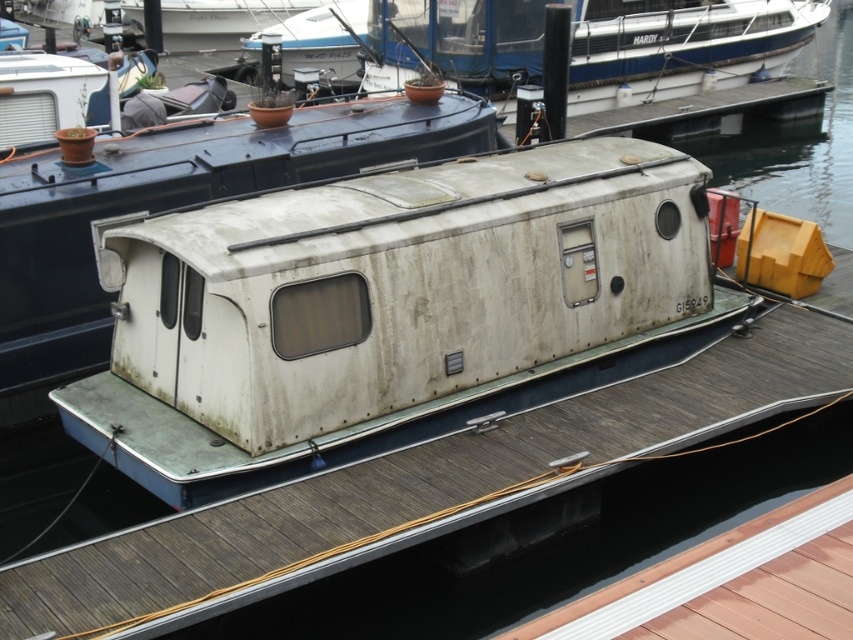
Describe the element at coordinates (392, 310) in the screenshot. I see `white matte boat at center` at that location.

Locate an element on the screen. white matte boat at center is located at coordinates (392, 310).

The image size is (853, 640). Find the location of `white matte boat at center`. white matte boat at center is located at coordinates (392, 310).

Is white matte deck at center positioned behind white matte cabin at center?

No, white matte deck at center is closer to the viewer.

Which is behind, point (830, 387) or point (486, 106)?

The point (486, 106) is behind.

Where is `white matte deck at center`? This screenshot has width=853, height=640. white matte deck at center is located at coordinates (428, 483).

From the picture: Which of these two, white matte cabin at center or white matte boat at upper center, stands shorter?

white matte cabin at center is shorter.

Is white matte cabin at center to the right of white matte boat at upper center from the viewer's perspective?

In fact, white matte cabin at center is to the left of white matte boat at upper center.

Does point (210, 170) come farther from viewer compared to point (498, 86)?

That is False.

What are the coordinates of `white matte cabin at center` in the screenshot? It's located at (172, 208).